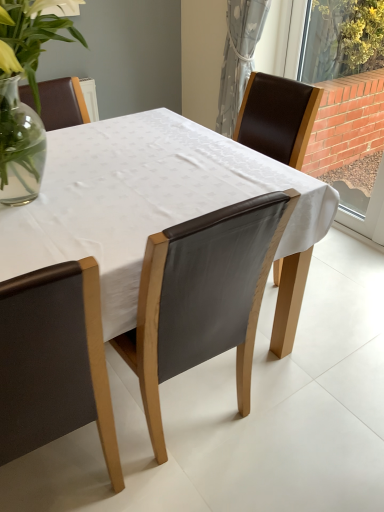
Find the location of a particular element. This screenshot has height=512, width=384. free area in between matte brown leather chair at lower left, which is the 2th chair from right to left, and leather at center, which appears as the second chair when viewed from the left is located at coordinates (135, 463).